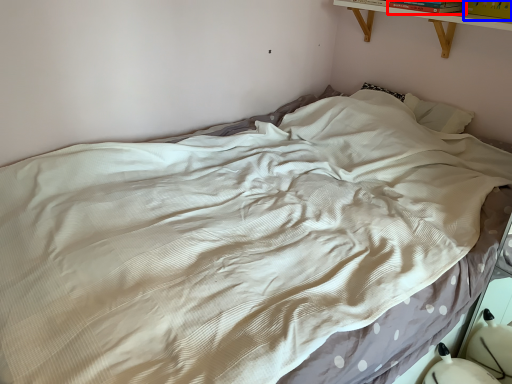
Question: Which object appears farthest to the camera in this image, book (highlighted by a red box) or book (highlighted by a blue box)?

Choices:
 (A) book
 (B) book

Answer: (A)